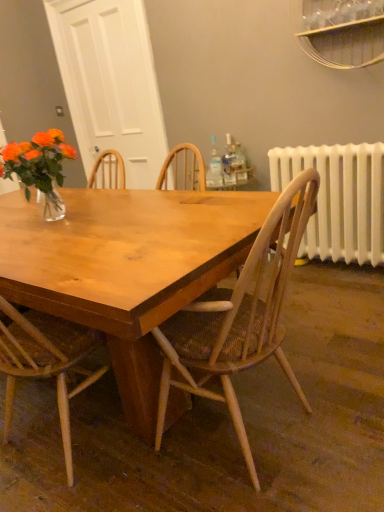
This screenshot has height=512, width=384. What do you see at coordinates (339, 199) in the screenshot?
I see `white plastic radiator at right` at bounding box center [339, 199].

I want to click on clear glass bottle at center, which is the first bottle from left to right, so click(x=214, y=168).

Identify the location of clear glass bottle at upper center, marked as the second bottle in a right-to-left arrangement. (228, 161).

Image resolution: width=384 pixels, height=512 pixels. What do you see at coordinates (228, 161) in the screenshot? I see `clear glass bottle at upper center, marked as the second bottle in a right-to-left arrangement` at bounding box center [228, 161].

What do you see at coordinates (239, 164) in the screenshot?
I see `translucent plastic bottle at upper right, which ranks as the first bottle in right-to-left order` at bounding box center [239, 164].

At what (x,y) coordinates should I click in order to perform the action: click on white plastic radiator at right. Please return your answer as a coordinate pair (x, y). Looking at the image, I should click on (339, 199).

Is white plastic radiator at right shorter than clear glass bottle at center, which is the first bottle from left to right?

No.

Is white plastic radiator at right facing towards clear glass bottle at center, the 3th bottle when ordered from right to left?

No, white plastic radiator at right is not oriented towards clear glass bottle at center, the 3th bottle when ordered from right to left.

From the image's perspective, between white plastic radiator at right and clear glass bottle at center, the 3th bottle when ordered from right to left, who is located below?

white plastic radiator at right is shown below in the image.

From a real-world perspective, between white plastic radiator at right and clear glass bottle at center, which is the first bottle from left to right, who is vertically lower?

white plastic radiator at right.

Does clear glass bottle at upper center, marked as the second bottle in a right-to-left arrangement, have a greater width compared to translucent plastic bottle at upper right, the 3th bottle positioned from the left?

Correct, the width of clear glass bottle at upper center, marked as the second bottle in a right-to-left arrangement, exceeds that of translucent plastic bottle at upper right, the 3th bottle positioned from the left.

From the picture: Between clear glass bottle at upper center, the 2th bottle in the left-to-right sequence, and translucent plastic bottle at upper right, the 3th bottle positioned from the left, which one has smaller size?

With smaller size is translucent plastic bottle at upper right, the 3th bottle positioned from the left.

Is clear glass bottle at upper center, the 2th bottle in the left-to-right sequence, inside the boundaries of translucent plastic bottle at upper right, which ranks as the first bottle in right-to-left order, or outside?

clear glass bottle at upper center, the 2th bottle in the left-to-right sequence, exists outside the volume of translucent plastic bottle at upper right, which ranks as the first bottle in right-to-left order.

From the picture: Which is behind, white plastic radiator at right or clear glass bottle at upper center, marked as the second bottle in a right-to-left arrangement?

clear glass bottle at upper center, marked as the second bottle in a right-to-left arrangement, is further from the camera.

Which point is more distant from viewer, [350,225] or [233,155]?

Point [233,155]

Is white plastic radiator at right at the right side of clear glass bottle at upper center, the 2th bottle in the left-to-right sequence?

Correct, you'll find white plastic radiator at right to the right of clear glass bottle at upper center, the 2th bottle in the left-to-right sequence.

Does white plastic radiator at right contain clear glass bottle at upper center, marked as the second bottle in a right-to-left arrangement?

No, clear glass bottle at upper center, marked as the second bottle in a right-to-left arrangement, is not inside white plastic radiator at right.

Which point is more forward, (209,170) or (226,147)?

Point (226,147)

Is clear glass bottle at center, the 3th bottle when ordered from right to left, not within clear glass bottle at upper center, the 2th bottle in the left-to-right sequence?

Yes, clear glass bottle at center, the 3th bottle when ordered from right to left, is outside of clear glass bottle at upper center, the 2th bottle in the left-to-right sequence.

Can you confirm if clear glass bottle at center, the 3th bottle when ordered from right to left, is positioned to the right of clear glass bottle at upper center, the 2th bottle in the left-to-right sequence?

No.

Locate an element on the screen. This screenshot has height=512, width=384. the 1st bottle below the clear glass bottle at upper center, the 2th bottle in the left-to-right sequence (from the image's perspective) is located at coordinates (214, 168).

Choose the correct answer: Is clear glass bottle at center, the 3th bottle when ordered from right to left, inside wooden chair at center or outside it?

clear glass bottle at center, the 3th bottle when ordered from right to left, lies outside wooden chair at center.

Between clear glass bottle at center, which is the first bottle from left to right, and wooden chair at center, which one has more height?

wooden chair at center.

How far apart are clear glass bottle at center, which is the first bottle from left to right, and wooden chair at center?

1.78 meters.

Does point (214, 186) come closer to viewer compared to point (201, 311)?

No, (214, 186) is further to viewer.

Considering the sizes of objects wooden chair at center and translucent plastic bottle at upper right, which ranks as the first bottle in right-to-left order, in the image provided, who is bigger, wooden chair at center or translucent plastic bottle at upper right, which ranks as the first bottle in right-to-left order,?

wooden chair at center is bigger.

Is wooden chair at center situated inside translucent plastic bottle at upper right, which ranks as the first bottle in right-to-left order, or outside?

wooden chair at center lies outside translucent plastic bottle at upper right, which ranks as the first bottle in right-to-left order.

Considering the relative positions of wooden chair at center and translucent plastic bottle at upper right, the 3th bottle positioned from the left, in the image provided, is wooden chair at center to the left of translucent plastic bottle at upper right, the 3th bottle positioned from the left, from the viewer's perspective?

Indeed, wooden chair at center is positioned on the left side of translucent plastic bottle at upper right, the 3th bottle positioned from the left.

Where is `the 1st bottle located above the wooden chair at center (from a real-world perspective)`? Image resolution: width=384 pixels, height=512 pixels. the 1st bottle located above the wooden chair at center (from a real-world perspective) is located at coordinates (239, 164).

Would you say clear glass bottle at upper center, marked as the second bottle in a right-to-left arrangement, is to the left or to the right of clear glass bottle at center, the 3th bottle when ordered from right to left, in the picture?

clear glass bottle at upper center, marked as the second bottle in a right-to-left arrangement, is positioned on clear glass bottle at center, the 3th bottle when ordered from right to left,'s right side.

From the image's perspective, which is above, clear glass bottle at upper center, marked as the second bottle in a right-to-left arrangement, or clear glass bottle at center, which is the first bottle from left to right?

clear glass bottle at upper center, marked as the second bottle in a right-to-left arrangement, is shown above in the image.

Locate an element on the screen. the 1st bottle to the right of the clear glass bottle at center, the 3th bottle when ordered from right to left, counting from the anchor's position is located at coordinates (228, 161).

How many degrees apart are the facing directions of clear glass bottle at upper center, the 2th bottle in the left-to-right sequence, and clear glass bottle at center, the 3th bottle when ordered from right to left?

The facing directions of clear glass bottle at upper center, the 2th bottle in the left-to-right sequence, and clear glass bottle at center, the 3th bottle when ordered from right to left, are 0.000243 degrees apart.

Starting from the white plastic radiator at right, which bottle is the 3rd one to the left? Please provide its 2D coordinates.

[(214, 168)]

Where is `bottle that appears behind the translucent plastic bottle at upper right, which ranks as the first bottle in right-to-left order`? bottle that appears behind the translucent plastic bottle at upper right, which ranks as the first bottle in right-to-left order is located at coordinates (228, 161).

When comparing their distances from clear glass bottle at upper center, the 2th bottle in the left-to-right sequence, does white plastic radiator at right or translucent plastic bottle at upper right, which ranks as the first bottle in right-to-left order, seem further?

white plastic radiator at right.

When comparing their distances from translucent plastic bottle at upper right, the 3th bottle positioned from the left, does clear glass bottle at upper center, marked as the second bottle in a right-to-left arrangement, or white plastic radiator at right seem further?

The object further to translucent plastic bottle at upper right, the 3th bottle positioned from the left, is white plastic radiator at right.

Looking at the image, which one is located closer to translucent plastic bottle at upper right, the 3th bottle positioned from the left, clear glass bottle at upper center, marked as the second bottle in a right-to-left arrangement, or wooden chair at center?

clear glass bottle at upper center, marked as the second bottle in a right-to-left arrangement.

Estimate the real-world distances between objects in this image. Which object is further from clear glass bottle at upper center, marked as the second bottle in a right-to-left arrangement, wooden chair at center or white plastic radiator at right?

Based on the image, wooden chair at center appears to be further to clear glass bottle at upper center, marked as the second bottle in a right-to-left arrangement.

From the image, which object appears to be nearer to white plastic radiator at right, clear glass bottle at center, the 3th bottle when ordered from right to left, or wooden chair at center?

The object closer to white plastic radiator at right is clear glass bottle at center, the 3th bottle when ordered from right to left.

Based on their spatial positions, is translucent plastic bottle at upper right, which ranks as the first bottle in right-to-left order, or wooden chair at center further from white plastic radiator at right?

wooden chair at center is positioned further to the anchor white plastic radiator at right.

Based on their spatial positions, is clear glass bottle at center, which is the first bottle from left to right, or translucent plastic bottle at upper right, the 3th bottle positioned from the left, closer to white plastic radiator at right?

Based on the image, translucent plastic bottle at upper right, the 3th bottle positioned from the left, appears to be nearer to white plastic radiator at right.

Considering their positions, is clear glass bottle at upper center, marked as the second bottle in a right-to-left arrangement, positioned closer to white plastic radiator at right than wooden chair at center?

clear glass bottle at upper center, marked as the second bottle in a right-to-left arrangement, is closer to white plastic radiator at right.

Find the location of `bottle between white plastic radiator at right and translucent plastic bottle at upper right, the 3th bottle positioned from the left, along the z-axis`. bottle between white plastic radiator at right and translucent plastic bottle at upper right, the 3th bottle positioned from the left, along the z-axis is located at coordinates (214, 168).

This screenshot has width=384, height=512. I want to click on radiator positioned between wooden chair at center and clear glass bottle at upper center, marked as the second bottle in a right-to-left arrangement, from near to far, so point(339,199).

Identify the location of bottle located between clear glass bottle at center, the 3th bottle when ordered from right to left, and translucent plastic bottle at upper right, the 3th bottle positioned from the left, in the left-right direction. The height and width of the screenshot is (512, 384). (228, 161).

This screenshot has width=384, height=512. In order to click on bottle between wooden chair at center and translucent plastic bottle at upper right, which ranks as the first bottle in right-to-left order, in the front-back direction in this screenshot , I will do click(x=214, y=168).